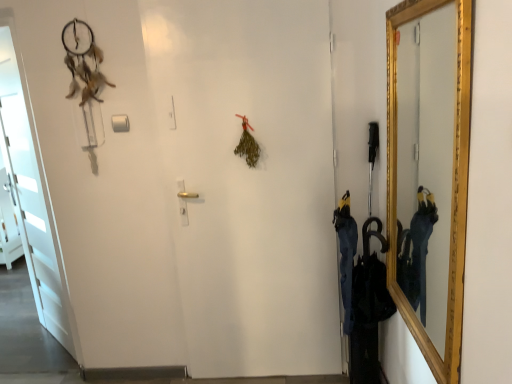
Question: From the image's perspective, is white matte door at left over gold-framed mirror at right?

Choices:
 (A) no
 (B) yes

Answer: (A)

Question: Can you confirm if white matte door at left is taller than gold-framed mirror at right?

Choices:
 (A) yes
 (B) no

Answer: (A)

Question: From a real-world perspective, is white matte door at left positioned over gold-framed mirror at right based on gravity?

Choices:
 (A) yes
 (B) no

Answer: (B)

Question: Considering the relative sizes of white matte door at left and gold-framed mirror at right in the image provided, is white matte door at left smaller than gold-framed mirror at right?

Choices:
 (A) yes
 (B) no

Answer: (B)

Question: Is white matte door at left positioned beyond the bounds of gold-framed mirror at right?

Choices:
 (A) no
 (B) yes

Answer: (B)

Question: Is white matte door at left far away from gold-framed mirror at right?

Choices:
 (A) no
 (B) yes

Answer: (B)

Question: Considering the relative positions of gold-framed mirror at right and white matte door at left in the image provided, is gold-framed mirror at right behind white matte door at left?

Choices:
 (A) no
 (B) yes

Answer: (A)

Question: Is gold-framed mirror at right thinner than white matte door at left?

Choices:
 (A) no
 (B) yes

Answer: (B)

Question: Is gold-framed mirror at right aimed at white matte door at left?

Choices:
 (A) yes
 (B) no

Answer: (A)

Question: From a real-world perspective, is gold-framed mirror at right positioned under white matte door at left based on gravity?

Choices:
 (A) yes
 (B) no

Answer: (B)

Question: From the image's perspective, would you say gold-framed mirror at right is positioned over white matte door at left?

Choices:
 (A) yes
 (B) no

Answer: (A)

Question: Considering the relative sizes of gold-framed mirror at right and white matte door at left in the image provided, is gold-framed mirror at right smaller than white matte door at left?

Choices:
 (A) no
 (B) yes

Answer: (B)

Question: From a real-world perspective, relative to gold-framed mirror at right, is white matte door at left vertically above or below?

Choices:
 (A) above
 (B) below

Answer: (B)